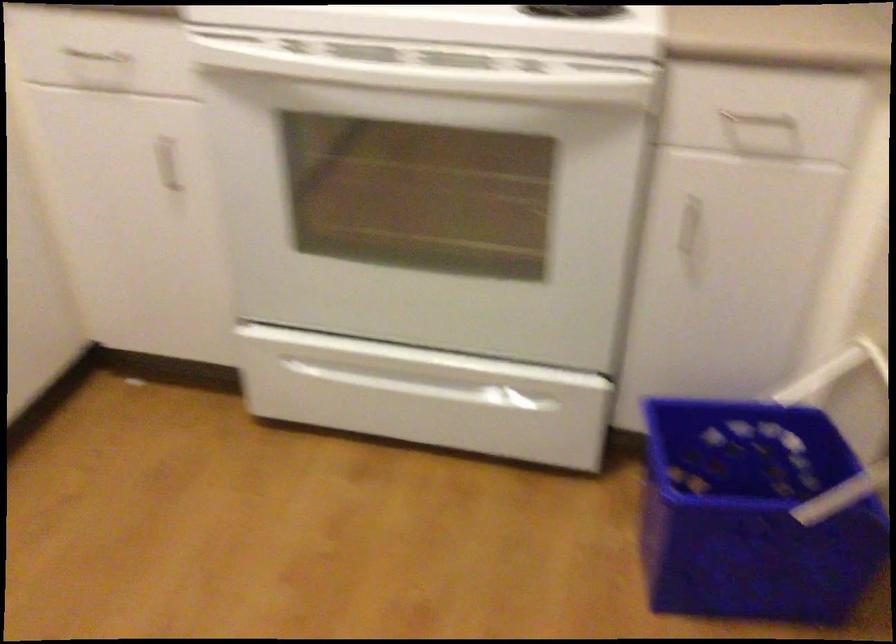
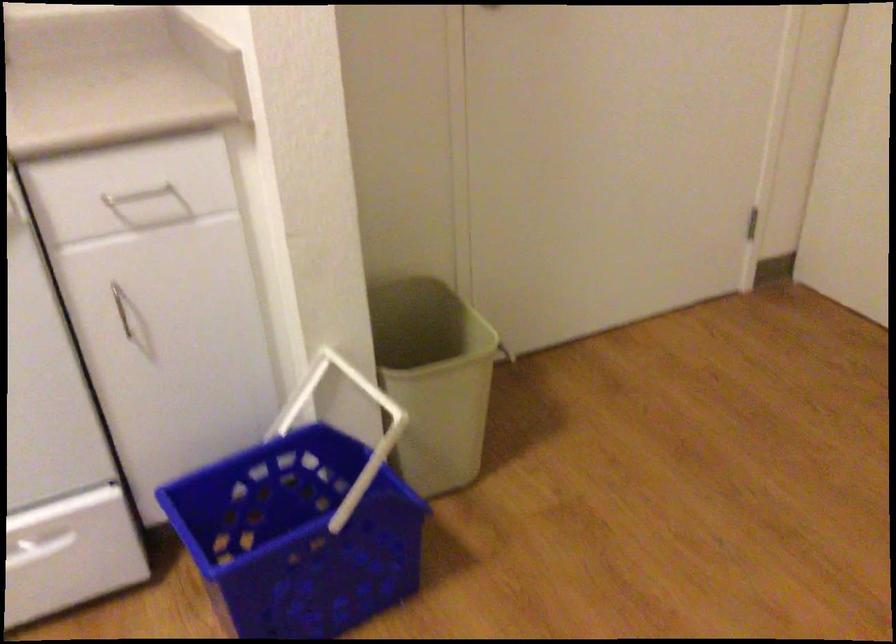
Question: The camera is either moving clockwise (left) or counter-clockwise (right) around the object. The first image is from the beginning of the video and the second image is from the end. Is the camera moving left or right when shooting the video?

Choices:
 (A) Left
 (B) Right

Answer: (A)